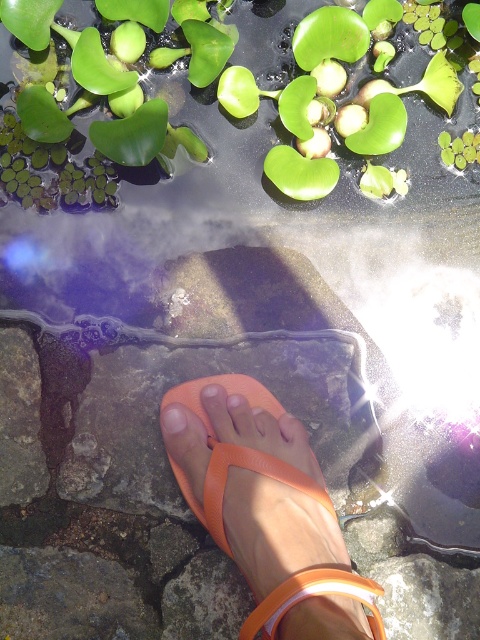
Question: Which object is farther from the camera taking this photo?

Choices:
 (A) pale skin at center
 (B) orange rubber sandal at center
 (C) green leafy plant at upper center

Answer: (A)

Question: Is green leafy plant at upper center thinner than pale skin at center?

Choices:
 (A) no
 (B) yes

Answer: (A)

Question: Estimate the real-world distances between objects in this image. Which object is closer to the pale skin at center?

Choices:
 (A) orange rubber sandal at center
 (B) green leafy plant at upper center

Answer: (A)

Question: Is green leafy plant at upper center positioned at the back of orange rubber sandal at center?

Choices:
 (A) yes
 (B) no

Answer: (A)

Question: Among these points, which one is nearest to the camera?

Choices:
 (A) (299, 528)
 (B) (39, 122)
 (C) (176, 433)

Answer: (A)

Question: Is green leafy plant at upper center wider than pale skin at center?

Choices:
 (A) no
 (B) yes

Answer: (B)